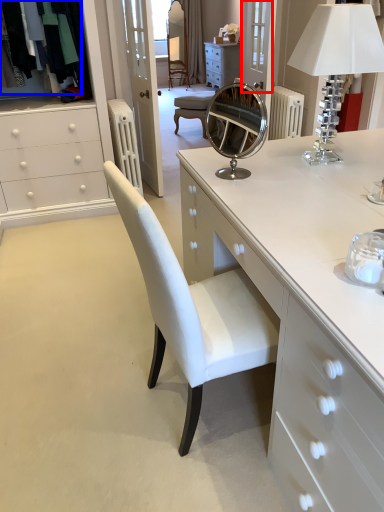
Question: Which object appears closest to the camera in this image, glass door (highlighted by a red box) or clothing (highlighted by a blue box)?

Choices:
 (A) glass door
 (B) clothing

Answer: (B)